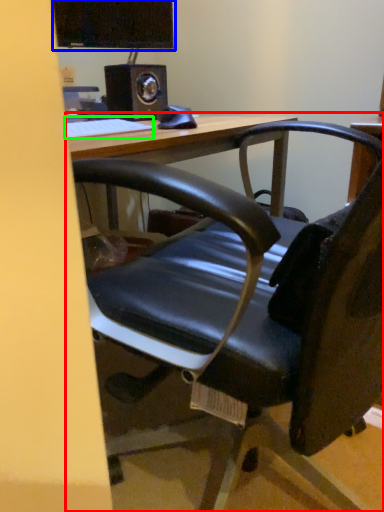
Question: Based on their relative distances, which object is nearer to table (highlighted by a red box)? Choose from computer monitor (highlighted by a blue box) and keyboard (highlighted by a green box).

Choices:
 (A) computer monitor
 (B) keyboard

Answer: (B)